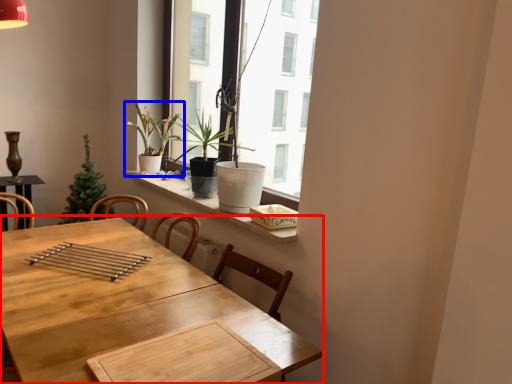
Question: Which of the following is the closest to the observer, table (highlighted by a red box) or houseplant (highlighted by a blue box)?

Choices:
 (A) table
 (B) houseplant

Answer: (A)